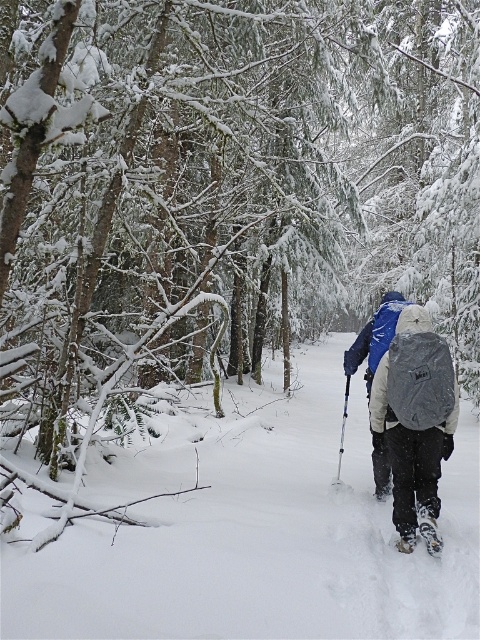
Question: Can you confirm if white fluffy snow at center is positioned to the right of gray fabric backpack at center?

Choices:
 (A) yes
 (B) no

Answer: (B)

Question: Which point is farther to the camera?

Choices:
 (A) white plastic snowshoe at lower right
 (B) white rubber snowshoe at lower center
 (C) blue plastic ski pole at center

Answer: (C)

Question: Among these points, which one is nearest to the camera?

Choices:
 (A) (x=399, y=532)
 (B) (x=432, y=550)
 (C) (x=423, y=429)

Answer: (B)

Question: Does white fluffy snow at center appear on the left side of blue plastic ski pole at center?

Choices:
 (A) yes
 (B) no

Answer: (A)

Question: Can you confirm if white fluffy snow at center is positioned to the right of white rubber snowshoe at lower center?

Choices:
 (A) no
 (B) yes

Answer: (A)

Question: Among these objects, which one is nearest to the camera?

Choices:
 (A) gray fabric backpack at center
 (B) white rubber snowshoe at lower center
 (C) blue fabric jacket at center

Answer: (A)